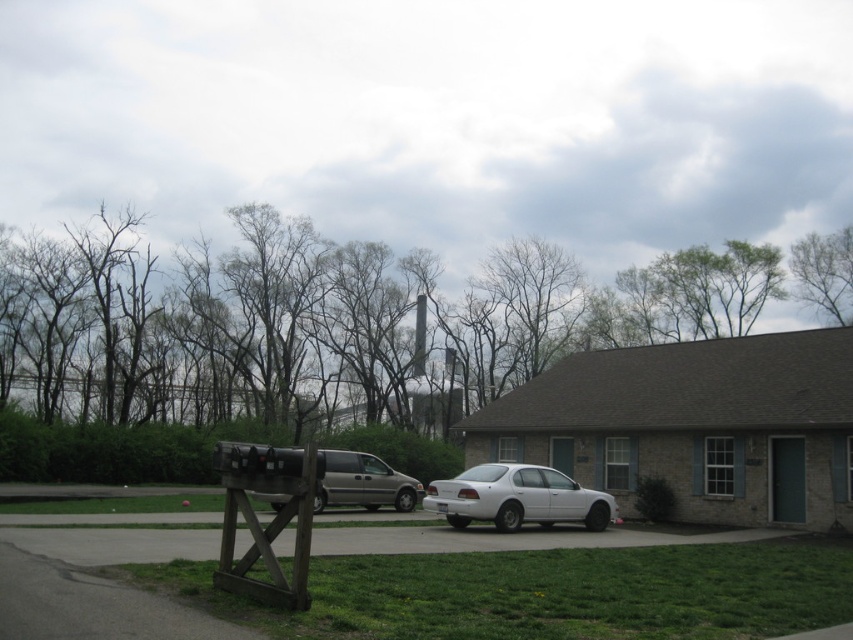
Question: Based on their relative distances, which object is nearer to the metallic silver van at center?

Choices:
 (A) gray asphalt driveway at lower left
 (B) white matte sedan at center
 (C) gray concrete driveway at lower center

Answer: (C)

Question: Is gray concrete driveway at lower center in front of metallic silver van at center?

Choices:
 (A) no
 (B) yes

Answer: (A)

Question: Is gray asphalt driveway at lower left further to camera compared to metallic silver van at center?

Choices:
 (A) no
 (B) yes

Answer: (A)

Question: Which point is closer to the camera taking this photo?

Choices:
 (A) (335, 529)
 (B) (321, 493)
 (C) (575, 492)

Answer: (A)

Question: In this image, where is gray concrete driveway at lower center located relative to white matte sedan at center?

Choices:
 (A) below
 (B) above

Answer: (B)

Question: Based on their relative distances, which object is farther from the gray concrete driveway at lower center?

Choices:
 (A) metallic silver van at center
 (B) white matte sedan at center

Answer: (A)